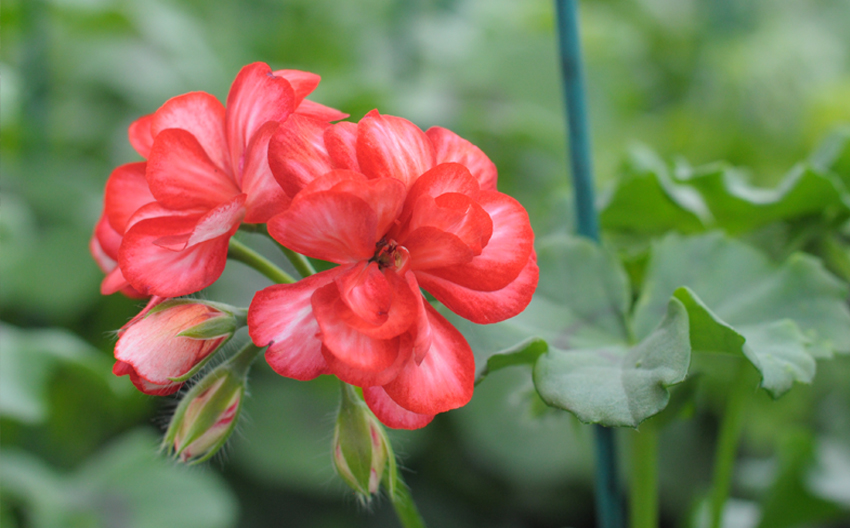
Image resolution: width=850 pixels, height=528 pixels. Identify the location of bulb. (184, 329).